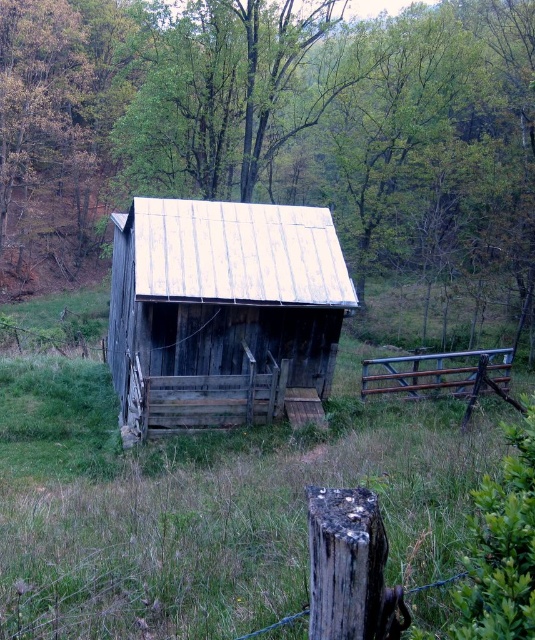
Between point (179, 416) and point (470, 394), which one is positioned behind?

Positioned behind is point (470, 394).

Is point (175, 394) in front of point (476, 394)?

No, it is not.

Identify the location of weathered wood cabin at center. The height and width of the screenshot is (640, 535). (223, 310).

Based on the photo, between weathered wood cabin at center and weathered brown wood at lower center, which one is positioned higher?

weathered wood cabin at center is above.

Is weathered wood cabin at center bigger than weathered brown wood at lower center?

Yes.

Which is behind, point (114, 380) or point (364, 624)?

The point (114, 380) is behind.

You are a GUI agent. You are given a task and a screenshot of the screen. Output one action in this format:
    pyautogui.click(x=<x>, y=<y>)
    Task: Click on the weathered wood cabin at center
    The width and height of the screenshot is (535, 640).
    Given the screenshot: What is the action you would take?
    click(x=223, y=310)

Which is above, green wood tree at center or weathered wood cabin at center?

Positioned higher is green wood tree at center.

Does green wood tree at center appear on the right side of weathered wood cabin at center?

Indeed, green wood tree at center is positioned on the right side of weathered wood cabin at center.

Where is `green wood tree at center`? green wood tree at center is located at coordinates (284, 141).